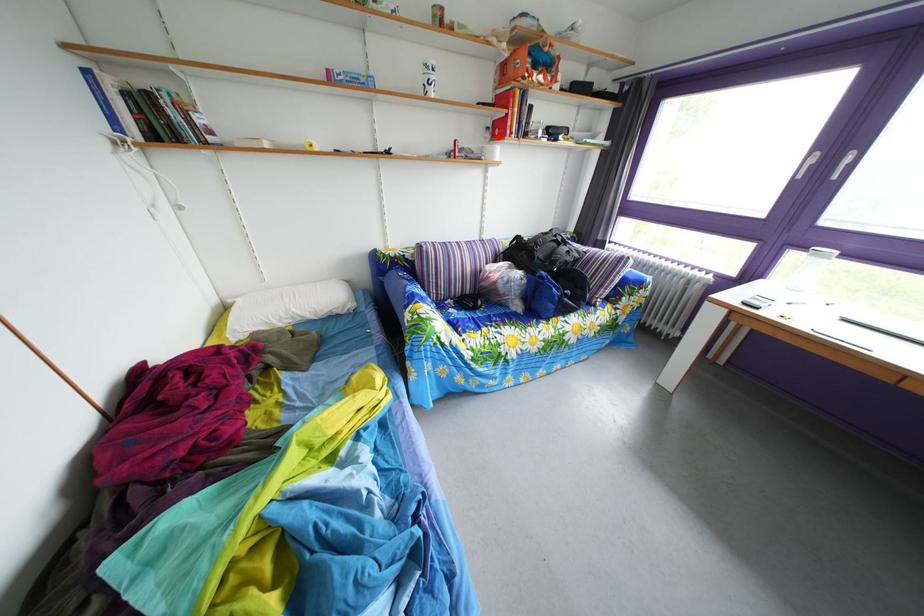
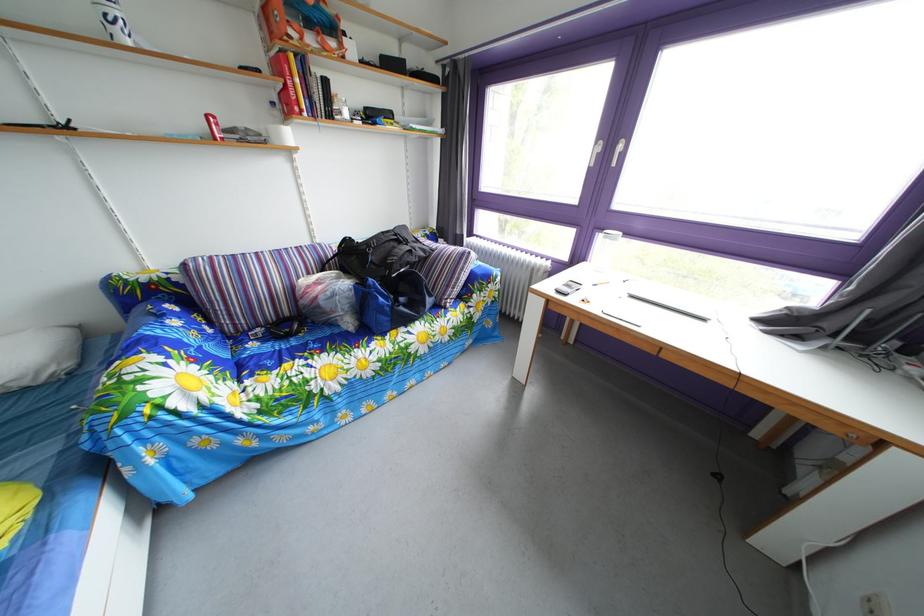
Find the pixel in the second image that matches the highlighted location in the first image.

(284, 111)